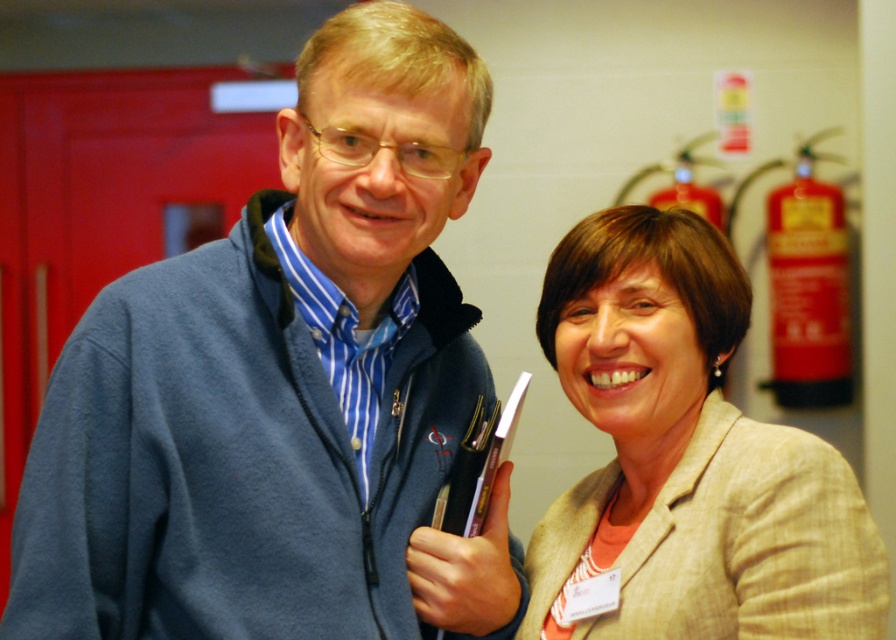
You are a photographer trying to capture a closeup shot of both the blue fleece jacket at left and the beige textured blazer at right in the scene. Given that your camera lens has a maximum focus range of 12 inches, will you be able to clearly capture both items in focus without moving the camera or subjects?

The distance between the blue fleece jacket at left and beige textured blazer at right is 12.20 inches. Since the camera lens can only focus up to 12 inches, the 0.20 inch excess means the items are slightly beyond the focus range. Moving the camera closer or adjusting the focus manually would be necessary for clarity.

You are standing in the room and want to reach both points marked in the image. Which point, point (506,566) or point (561,333), is closer to you?

Point (506,566) is closer to the viewer than point (561,333).